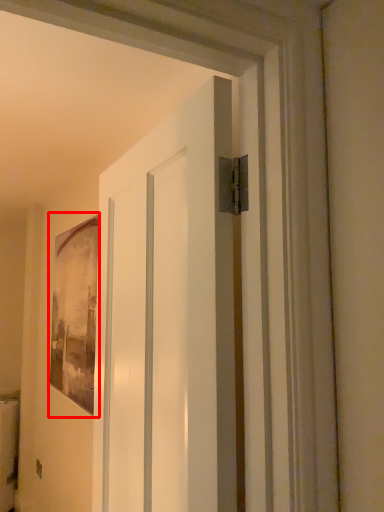
Question: In this image, where is picture frame (annotated by the red box) located relative to door?

Choices:
 (A) right
 (B) left

Answer: (B)